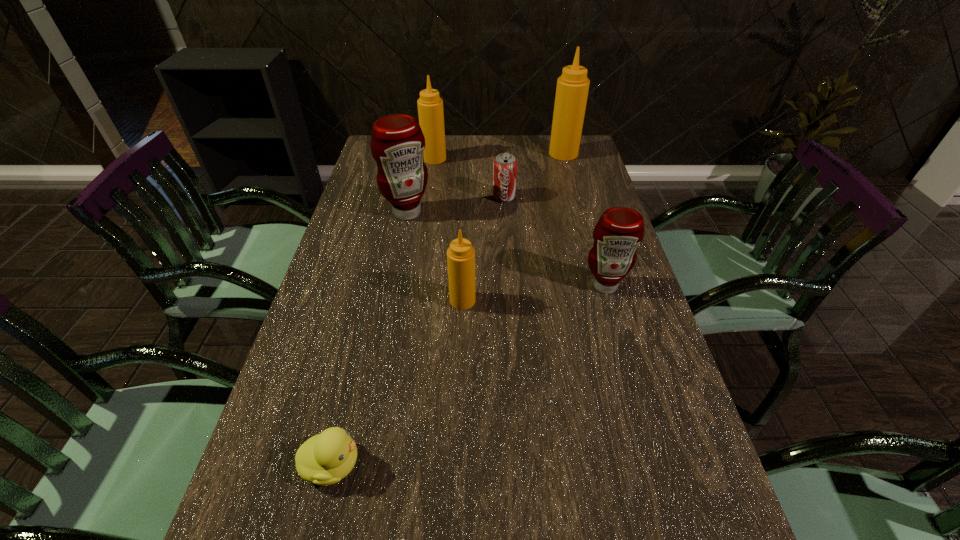
Locate an element on the screen. condiment at the left edge is located at coordinates (397, 143).

Where is `duckling situated at the left edge`? The height and width of the screenshot is (540, 960). duckling situated at the left edge is located at coordinates (324, 459).

Where is `object situated at the far right corner`? object situated at the far right corner is located at coordinates (572, 88).

The width and height of the screenshot is (960, 540). I want to click on vacant space at the far edge of the desktop, so click(527, 152).

In the image, there is a desktop. At what (x,y) coordinates should I click in order to perform the action: click on vacant space at the left edge. Please return your answer as a coordinate pair (x, y). Looking at the image, I should click on (293, 422).

Locate an element on the screen. vacant space at the right edge of the desktop is located at coordinates (696, 441).

The image size is (960, 540). I want to click on blank space at the far left corner of the desktop, so click(366, 163).

Locate an element on the screen. empty location between the second smallest tan condiment and the third condiment from left to right is located at coordinates (448, 230).

Locate an element on the screen. This screenshot has width=960, height=540. free space between the soda can and the tallest object is located at coordinates (534, 176).

I want to click on vacant point located between the leftmost tan condiment and the second tan condiment from right to left, so click(x=448, y=230).